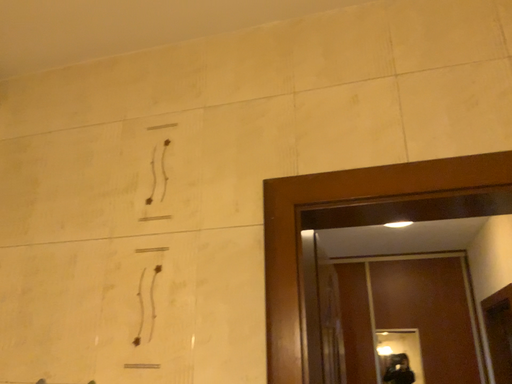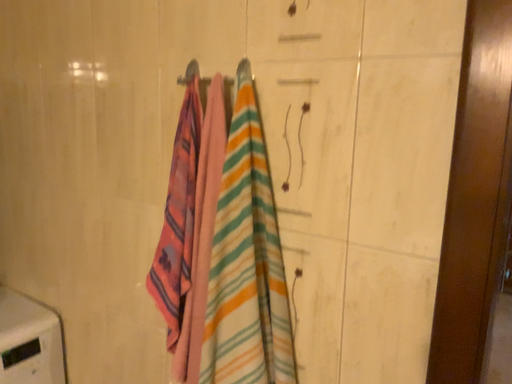
Question: Which way did the camera rotate in the video?

Choices:
 (A) rotated left
 (B) rotated right

Answer: (A)